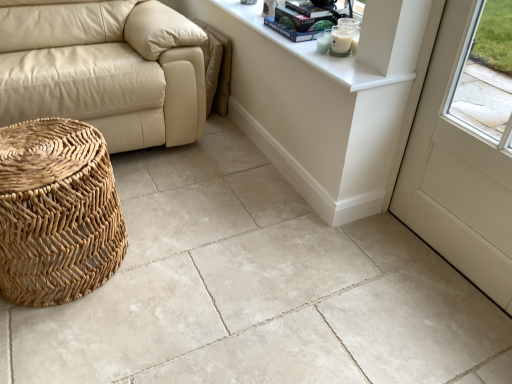
The image size is (512, 384). In order to click on vacant point above natural woven basket at lower left (from a real-world perspective) in this screenshot , I will do [x=38, y=158].